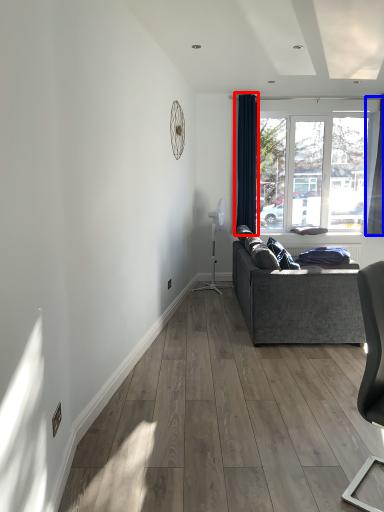
Question: Which object is further to the camera taking this photo, curtain (highlighted by a red box) or curtain (highlighted by a blue box)?

Choices:
 (A) curtain
 (B) curtain

Answer: (A)